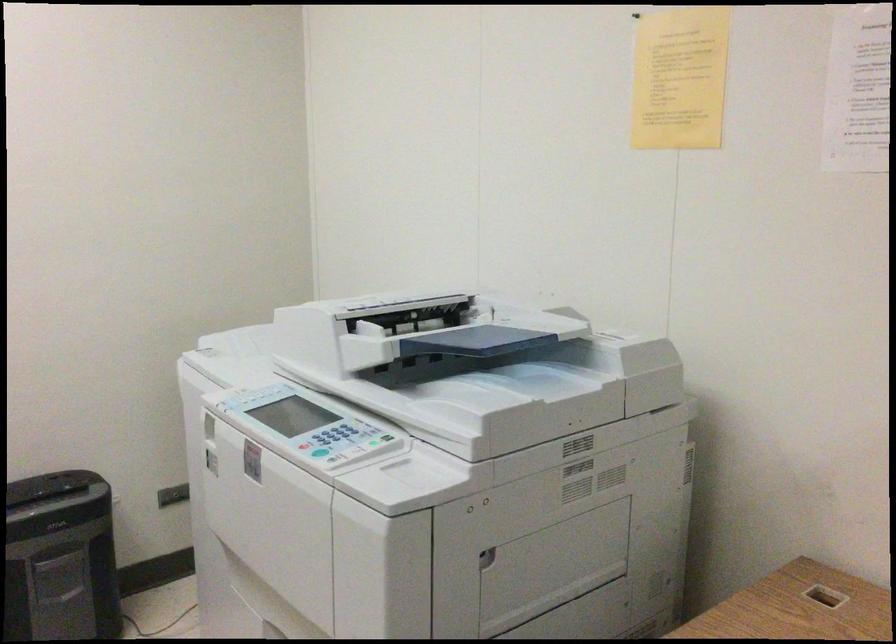
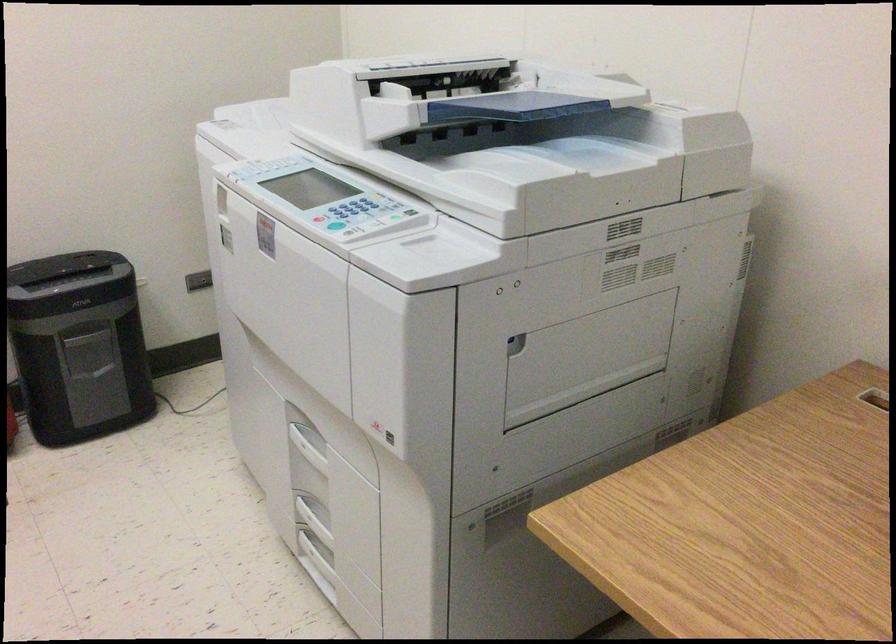
Question: I am providing you with two images of the same scene from different viewpoints. Please identify which objects are invisible in image2.

Choices:
 (A) printer control buttons
 (B) printer door handle
 (C) paper shredder slot
 (D) none of these

Answer: (D)